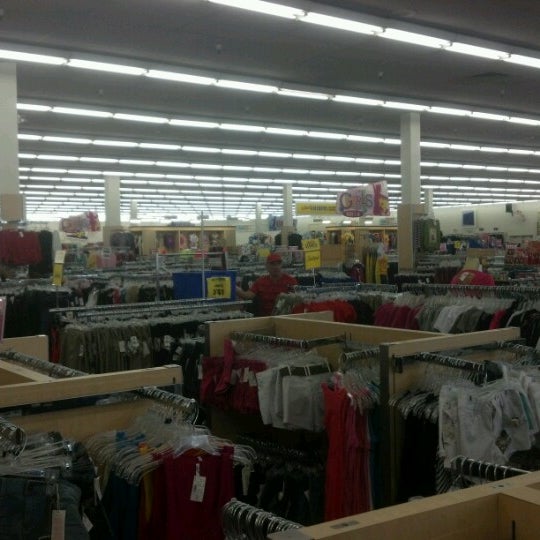
Identify the location of mannequin. (474, 280).